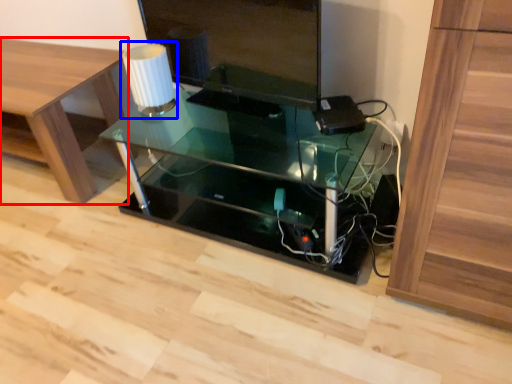
Question: Which of the following is the farthest to the observer, furniture (highlighted by a red box) or table lamp (highlighted by a blue box)?

Choices:
 (A) furniture
 (B) table lamp

Answer: (A)